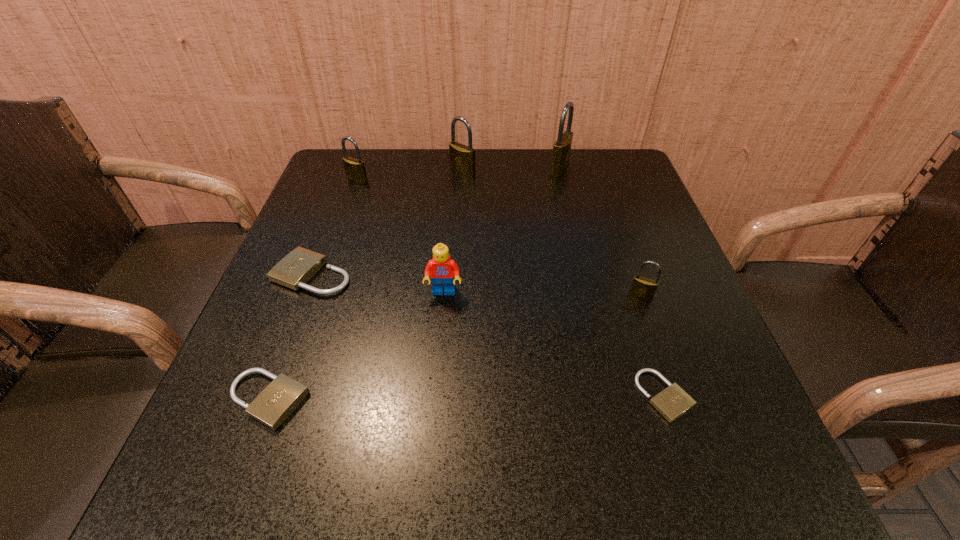
The image size is (960, 540). What are the coordinates of `the sixth object from left to right` in the screenshot? It's located at (561, 150).

Find the location of a particular element. Image resolution: width=960 pixels, height=540 pixels. the tallest padlock is located at coordinates (561, 150).

Identify the location of the sixth shortest padlock. The height and width of the screenshot is (540, 960). (462, 158).

At what (x,y) coordinates should I click in order to perform the action: click on the second tallest object. Please return your answer as a coordinate pair (x, y). This screenshot has height=540, width=960. Looking at the image, I should click on (462, 158).

Locate an element on the screen. the leftmost brass padlock is located at coordinates (355, 170).

Identify the location of the second smallest brass padlock. This screenshot has height=540, width=960. pyautogui.click(x=355, y=170).

Locate an element on the screen. This screenshot has height=540, width=960. Lego is located at coordinates (441, 268).

The width and height of the screenshot is (960, 540). I want to click on the nearest brass padlock, so tap(644, 288).

At what (x,y) coordinates should I click in order to perform the action: click on the smallest brass padlock. Please return your answer as a coordinate pair (x, y). Looking at the image, I should click on (644, 288).

Locate an element on the screen. The height and width of the screenshot is (540, 960). the biggest beige padlock is located at coordinates (300, 265).